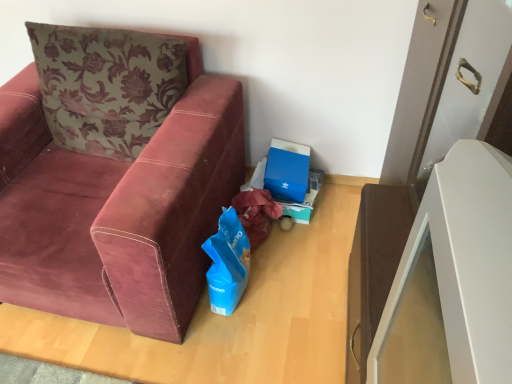
Question: In the image, is blue cardboard box at center on the left side or the right side of velvet maroon couch at left?

Choices:
 (A) right
 (B) left

Answer: (A)

Question: From the image's perspective, is blue cardboard box at center positioned above or below velvet maroon couch at left?

Choices:
 (A) below
 (B) above

Answer: (A)

Question: Based on their relative distances, which object is farther from the velvet maroon couch at left?

Choices:
 (A) blue matte gift bag at lower center
 (B) blue cardboard box at center

Answer: (B)

Question: Estimate the real-world distances between objects in this image. Which object is closer to the blue matte gift bag at lower center?

Choices:
 (A) velvet maroon couch at left
 (B) blue cardboard box at center

Answer: (A)